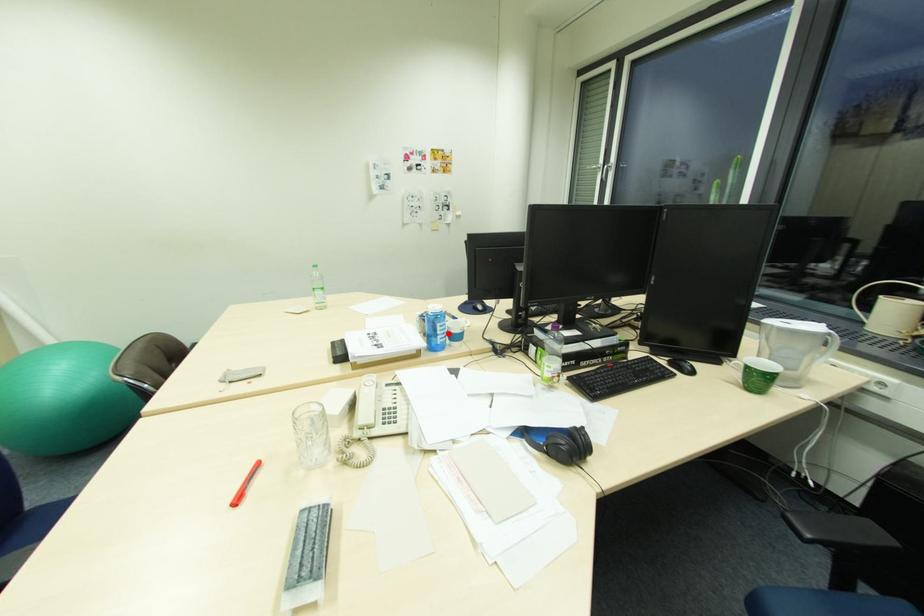
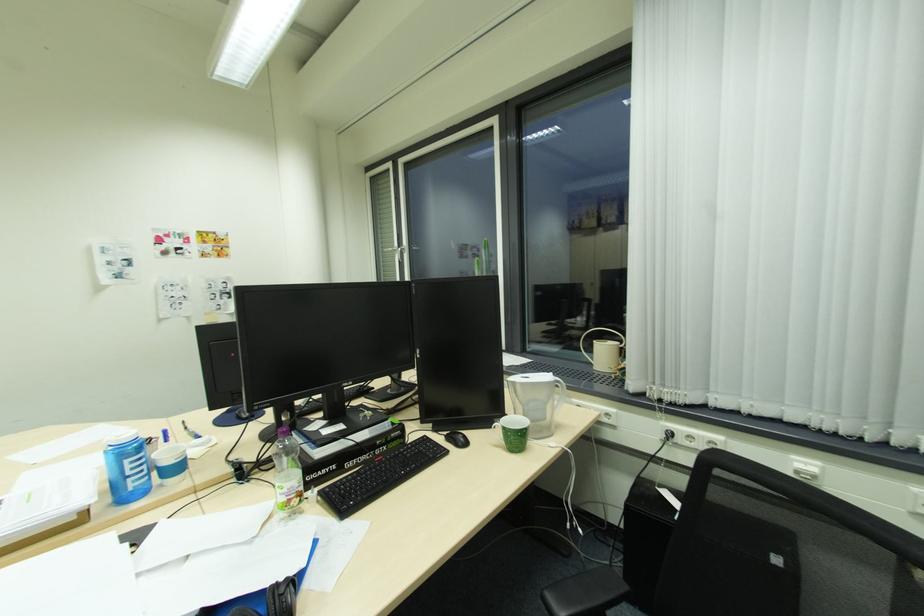
Locate, in the second image, the point that corresponds to the highlighted location in the first image.

(146, 472)